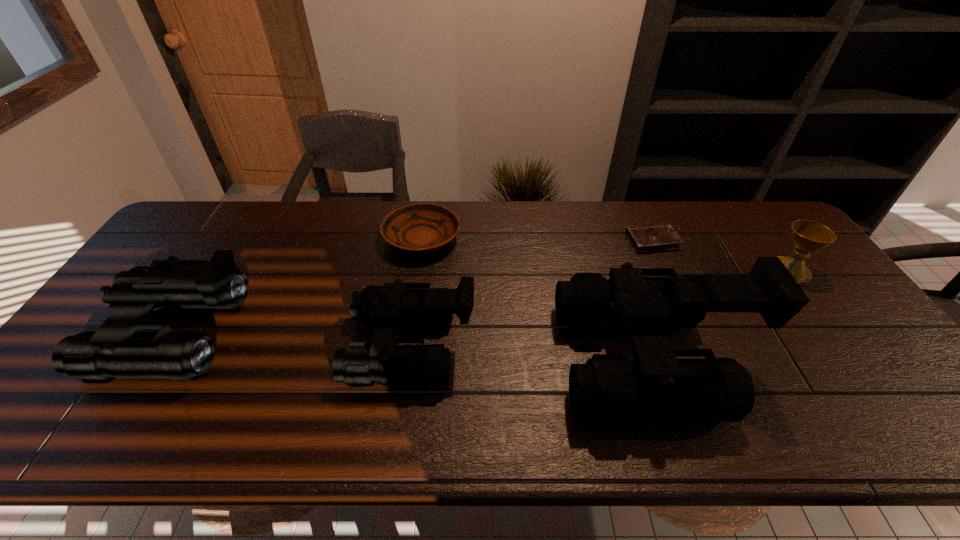
Please point a spot on the right to add another binoculars. Please provide its 2D coordinates. Your answer should be formatted as a tuple, i.e. [(x, y)], where the tuple contains the x and y coordinates of a point satisfying the conditions above.

[(902, 372)]